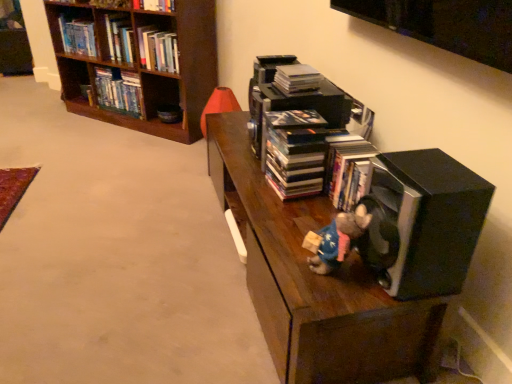
Question: From a real-world perspective, is hardcover book at upper left, the 1th book positioned from the left, under dark wood shelf at center?

Choices:
 (A) yes
 (B) no

Answer: (B)

Question: From the image's perspective, is hardcover book at upper left, which ranks as the 1th book in top-to-bottom order, on dark wood shelf at center?

Choices:
 (A) no
 (B) yes

Answer: (B)

Question: From a real-world perspective, is hardcover book at upper left, which ranks as the 4th book in right-to-left order, on top of dark wood shelf at center?

Choices:
 (A) yes
 (B) no

Answer: (A)

Question: Is hardcover book at upper left, the 1th book positioned from the left, not close to dark wood shelf at center?

Choices:
 (A) no
 (B) yes

Answer: (B)

Question: Is dark wood shelf at center located within hardcover book at upper left, the 1th book positioned from the left?

Choices:
 (A) yes
 (B) no

Answer: (B)

Question: Looking at their shapes, would you say black matte book at center, which is the fourth book in left-to-right order, is wider or thinner than plush toy at center?

Choices:
 (A) thin
 (B) wide

Answer: (B)

Question: Choose the correct answer: Is black matte book at center, which is the 4th book in back-to-front order, inside plush toy at center or outside it?

Choices:
 (A) outside
 (B) inside

Answer: (A)

Question: From a real-world perspective, is black matte book at center, which appears as the first book when viewed from the right, above or below plush toy at center?

Choices:
 (A) below
 (B) above

Answer: (B)

Question: In terms of height, does black matte book at center, which is the 4th book in back-to-front order, look taller or shorter compared to plush toy at center?

Choices:
 (A) short
 (B) tall

Answer: (B)

Question: Visually, is hardcover book at upper left, the second book from the front, positioned to the left or to the right of black matte speaker at lower right?

Choices:
 (A) left
 (B) right

Answer: (A)

Question: From their relative heights in the image, would you say hardcover book at upper left, the second book from the front, is taller or shorter than black matte speaker at lower right?

Choices:
 (A) short
 (B) tall

Answer: (A)

Question: Considering their positions, is hardcover book at upper left, which is the 3th book from back to front, located in front of or behind black matte speaker at lower right?

Choices:
 (A) behind
 (B) front

Answer: (A)

Question: Based on their sizes in the image, would you say hardcover book at upper left, which is counted as the 3th book, starting from the left, is bigger or smaller than black matte speaker at lower right?

Choices:
 (A) small
 (B) big

Answer: (A)

Question: Is black matte speaker at lower right taller or shorter than hardcover book at upper left, the fourth book ordered from the bottom?

Choices:
 (A) short
 (B) tall

Answer: (B)

Question: Considering the positions of point (436, 150) and point (82, 38), is point (436, 150) closer or farther from the camera than point (82, 38)?

Choices:
 (A) farther
 (B) closer

Answer: (B)